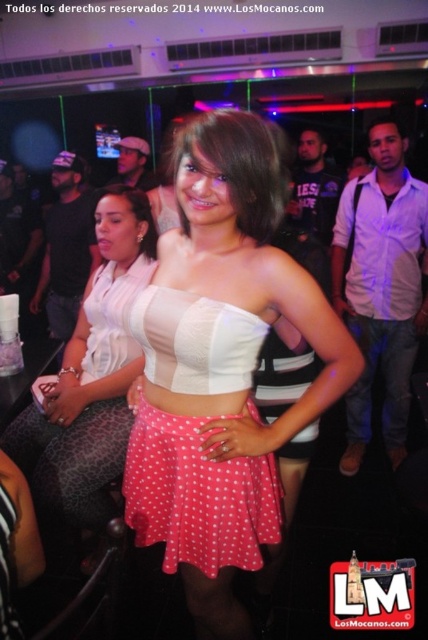
Question: Does white matte strapless top at center appear on the right side of jeans at center?

Choices:
 (A) yes
 (B) no

Answer: (B)

Question: Can you confirm if pink polka dot skirt at center is smaller than jeans at center?

Choices:
 (A) yes
 (B) no

Answer: (B)

Question: Which point appears closest to the camera in this image?

Choices:
 (A) (202, 525)
 (B) (392, 417)

Answer: (A)

Question: Which of these objects is positioned farthest from the white matte strapless top at center?

Choices:
 (A) pink polka dot skirt at center
 (B) jeans at center
 (C) white matte top at center

Answer: (B)

Question: Can you confirm if pink polka dot skirt at center is wider than white matte strapless top at center?

Choices:
 (A) yes
 (B) no

Answer: (A)

Question: Which point appears farthest from the camera in this image?

Choices:
 (A) (356, 401)
 (B) (68, 440)
 (C) (264, 461)
 (D) (259, 150)

Answer: (A)